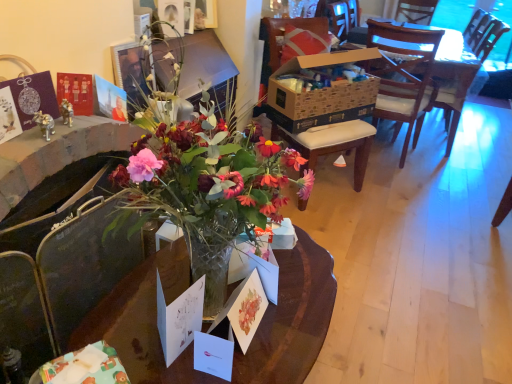
Locate an element on the screen. The width and height of the screenshot is (512, 384). vacant area to the right of white paper postcard at center, which is the 1th postcard from left to right is located at coordinates [x=258, y=349].